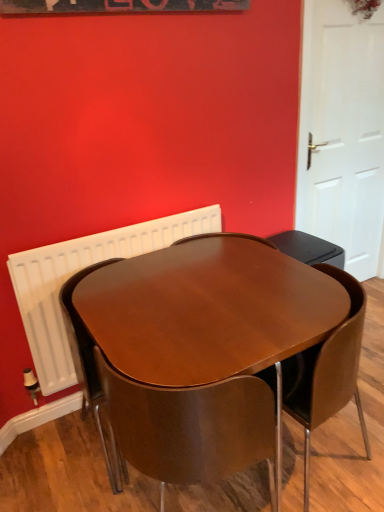
Question: In terms of height, does white radiator at upper left look taller or shorter compared to glossy wood table at center?

Choices:
 (A) short
 (B) tall

Answer: (A)

Question: From a real-world perspective, is white radiator at upper left above or below glossy wood table at center?

Choices:
 (A) below
 (B) above

Answer: (B)

Question: Which of these objects is positioned farthest from the white matte door at right?

Choices:
 (A) glossy wood table at center
 (B) wooden chair at center, arranged as the 2th chair when viewed from the right
 (C) brown leather chair at center, placed as the 2th chair when sorted from left to right
 (D) white radiator at upper left

Answer: (B)

Question: Which of these objects is positioned farthest from the glossy wood table at center?

Choices:
 (A) white matte door at right
 (B) brown leather chair at center, placed as the 2th chair when sorted from left to right
 (C) white radiator at upper left
 (D) wooden chair at center, arranged as the 2th chair when viewed from the right

Answer: (A)